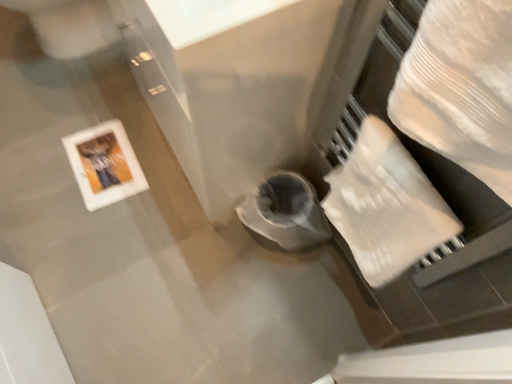
Question: Do you think white glossy picture frame at upper left is within white textured toilet paper at right, or outside of it?

Choices:
 (A) outside
 (B) inside

Answer: (A)

Question: Is white glossy picture frame at upper left wider or thinner than white textured toilet paper at right?

Choices:
 (A) wide
 (B) thin

Answer: (A)

Question: Considering the positions of white glossy picture frame at upper left and white textured toilet paper at right in the image, is white glossy picture frame at upper left bigger or smaller than white textured toilet paper at right?

Choices:
 (A) small
 (B) big

Answer: (A)

Question: Is point (336, 218) positioned closer to the camera than point (71, 135)?

Choices:
 (A) closer
 (B) farther

Answer: (A)

Question: Is white textured toilet paper at right inside or outside of white glossy picture frame at upper left?

Choices:
 (A) outside
 (B) inside

Answer: (A)

Question: From their relative heights in the image, would you say white textured toilet paper at right is taller or shorter than white glossy picture frame at upper left?

Choices:
 (A) tall
 (B) short

Answer: (A)

Question: Considering the positions of white textured toilet paper at right and white glossy picture frame at upper left in the image, is white textured toilet paper at right wider or thinner than white glossy picture frame at upper left?

Choices:
 (A) wide
 (B) thin

Answer: (B)